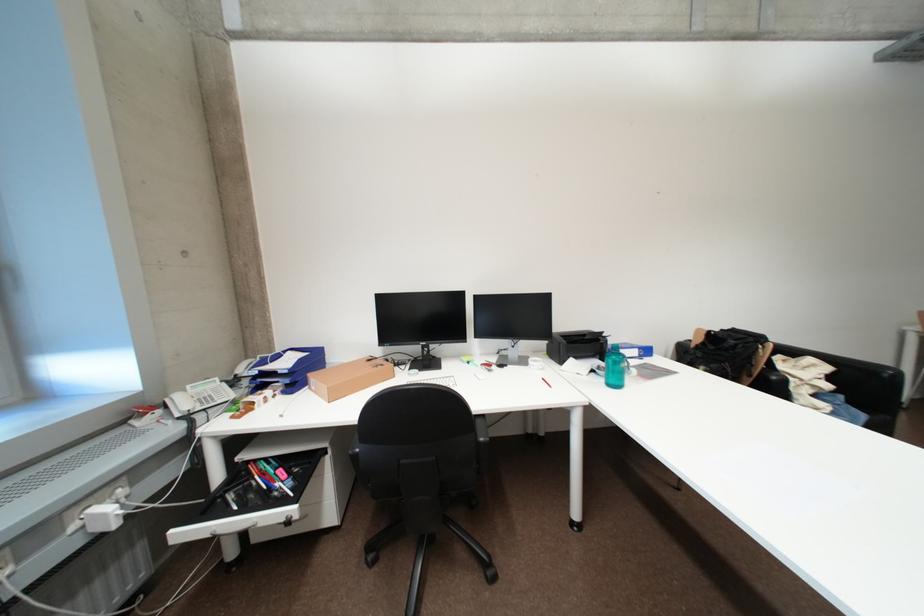
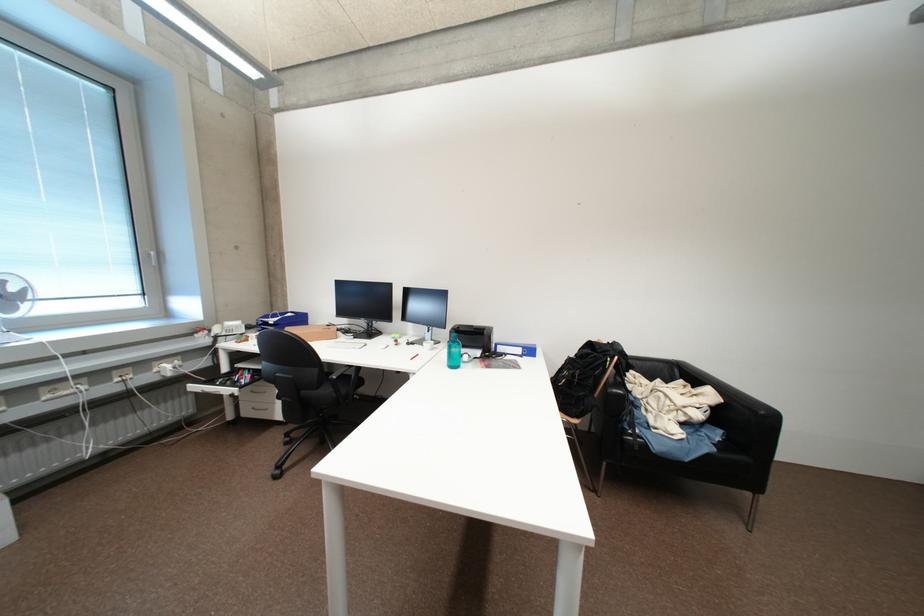
Find the pixel in the second image that matches pixel 191 406 in the first image.

(225, 331)